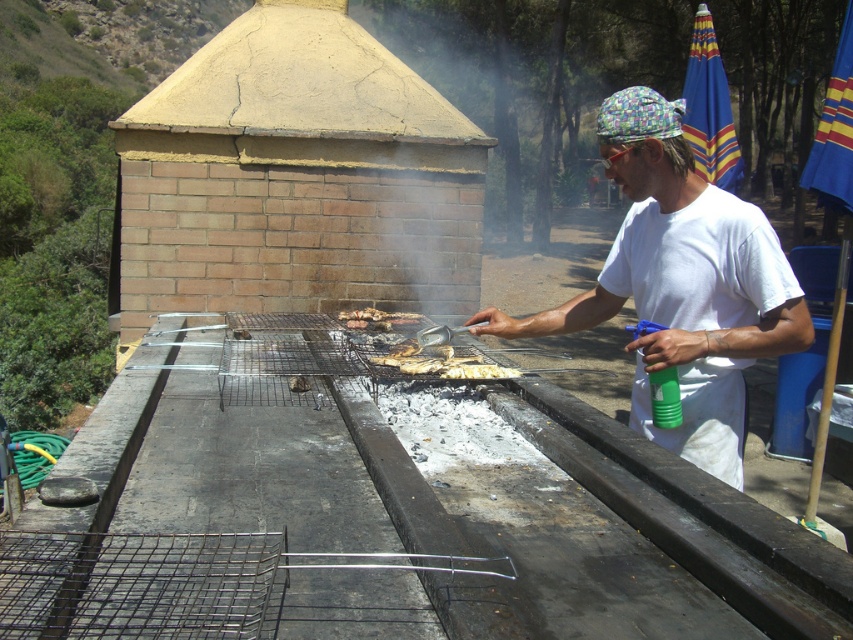
Question: Can you confirm if white cotton shirt at center is wider than charcoal briquettes at center?

Choices:
 (A) no
 (B) yes

Answer: (B)

Question: Which point is farther to the camera?

Choices:
 (A) charcoal briquettes at center
 (B) white cotton shirt at center

Answer: (A)

Question: Does white cotton shirt at center have a smaller size compared to charcoal briquettes at center?

Choices:
 (A) yes
 (B) no

Answer: (B)

Question: Can you confirm if white cotton shirt at center is wider than charcoal briquettes at center?

Choices:
 (A) no
 (B) yes

Answer: (B)